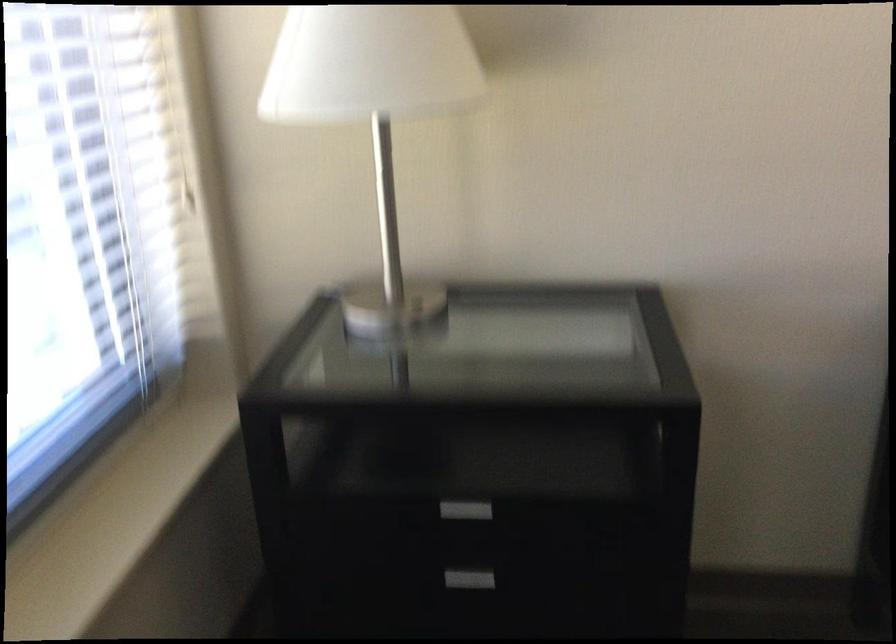
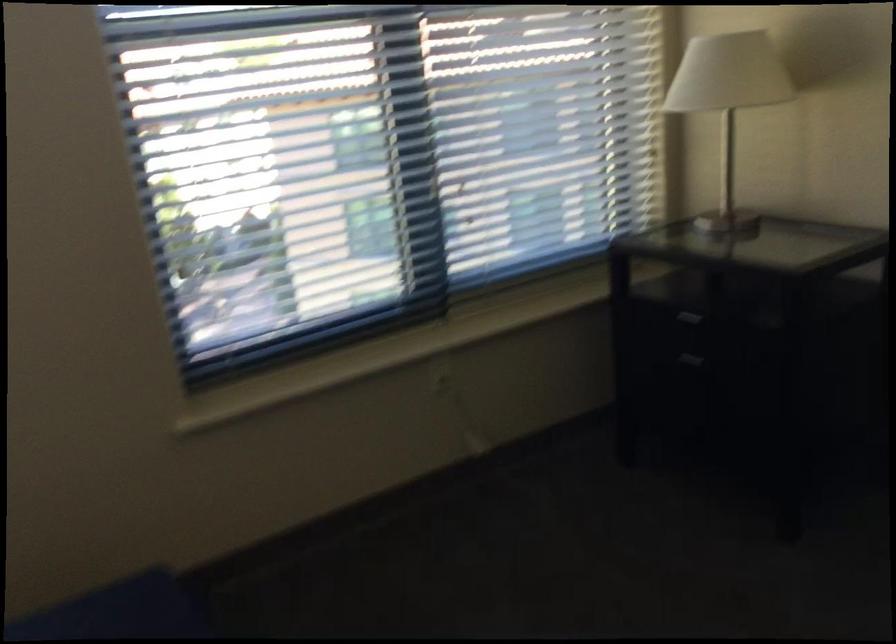
In the second image, find the point that corresponds to pixel 425 100 in the first image.

(728, 102)